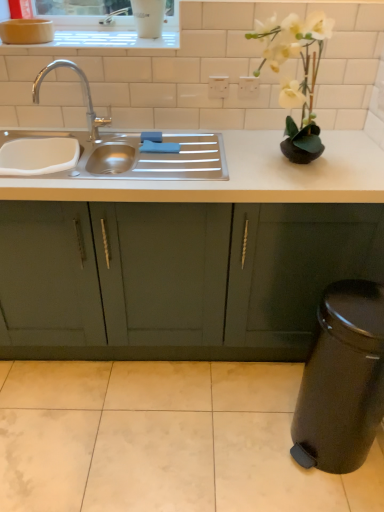
Question: Is white ceramic window sill at upper center oriented towards matte green cabinets at center?

Choices:
 (A) no
 (B) yes

Answer: (A)

Question: Does white ceramic window sill at upper center come behind matte green cabinets at center?

Choices:
 (A) yes
 (B) no

Answer: (A)

Question: Is white ceramic window sill at upper center smaller than matte green cabinets at center?

Choices:
 (A) yes
 (B) no

Answer: (A)

Question: Is matte green cabinets at center surrounded by white ceramic window sill at upper center?

Choices:
 (A) yes
 (B) no

Answer: (B)

Question: Can you confirm if white ceramic window sill at upper center is bigger than matte green cabinets at center?

Choices:
 (A) no
 (B) yes

Answer: (A)

Question: Does white ceramic window sill at upper center have a greater width compared to matte green cabinets at center?

Choices:
 (A) no
 (B) yes

Answer: (A)

Question: From the image's perspective, is white matte vase at upper right on top of matte green cabinets at center?

Choices:
 (A) no
 (B) yes

Answer: (B)

Question: Is white matte vase at upper right positioned in front of matte green cabinets at center?

Choices:
 (A) no
 (B) yes

Answer: (B)

Question: Is white matte vase at upper right smaller than matte green cabinets at center?

Choices:
 (A) no
 (B) yes

Answer: (B)

Question: Is white matte vase at upper right touching matte green cabinets at center?

Choices:
 (A) no
 (B) yes

Answer: (A)

Question: Considering the relative sizes of white matte vase at upper right and matte green cabinets at center in the image provided, is white matte vase at upper right bigger than matte green cabinets at center?

Choices:
 (A) yes
 (B) no

Answer: (B)

Question: Could you tell me if white matte vase at upper right is turned towards matte green cabinets at center?

Choices:
 (A) no
 (B) yes

Answer: (A)

Question: Does white matte vase at upper right lie in front of stainless steel sink at left?

Choices:
 (A) no
 (B) yes

Answer: (B)